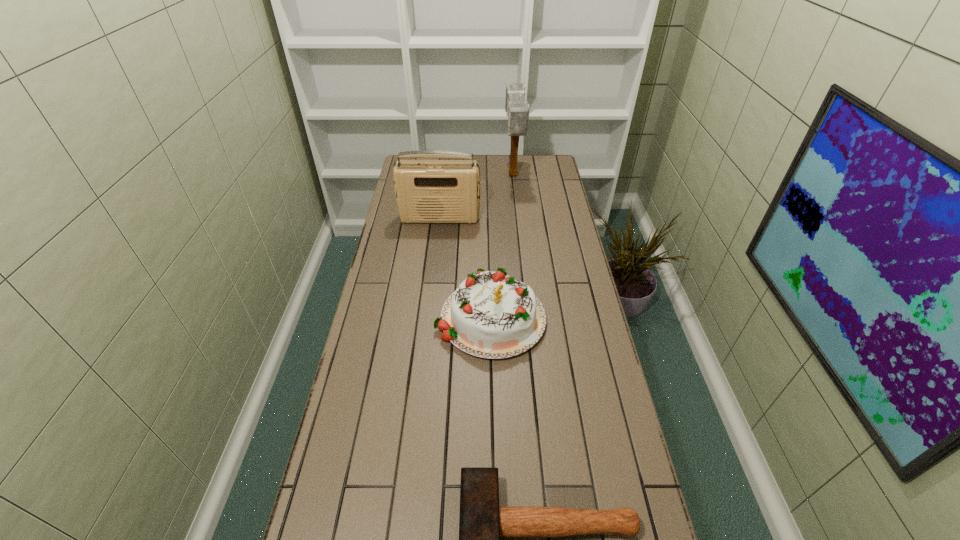
You are a GUI agent. You are given a task and a screenshot of the screen. Output one action in this format:
    pyautogui.click(x=<x>, y=<y>)
    Task: Click on the taller mallet
    The image size is (960, 540).
    Given the screenshot: What is the action you would take?
    pyautogui.click(x=516, y=106)

Where is `the tallest object`? This screenshot has width=960, height=540. the tallest object is located at coordinates [x=516, y=106].

I want to click on radio receiver, so click(427, 191).

Locate an element on the screen. The image size is (960, 540). the second tallest object is located at coordinates (427, 191).

Identify the location of the third tallest object. This screenshot has height=540, width=960. (490, 315).

The width and height of the screenshot is (960, 540). In order to click on the second nearest object in this screenshot , I will do `click(490, 315)`.

Find the location of a particular element. This screenshot has width=960, height=540. free space located 0.160m on the right of the taller mallet is located at coordinates (555, 176).

What are the coordinates of `free region located on the front-facing side of the third shortest object` in the screenshot? It's located at (433, 279).

Identify the location of vacant space positioned 0.090m on the back of the cake. The width and height of the screenshot is (960, 540). (489, 259).

Locate an element on the screen. The image size is (960, 540). object located in the far edge section of the desktop is located at coordinates (516, 106).